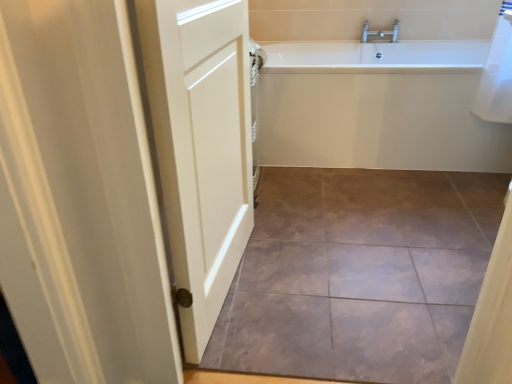
Question: In the image, is white glossy bathtub at upper right on the left side or the right side of white matte door at left?

Choices:
 (A) right
 (B) left

Answer: (A)

Question: Which is correct: white glossy bathtub at upper right is inside white matte door at left, or outside of it?

Choices:
 (A) outside
 (B) inside

Answer: (A)

Question: Considering the real-world distances, which object is farthest from the white glossy bathtub at upper right?

Choices:
 (A) white matte door at left
 (B) brown textured tile at center

Answer: (A)

Question: Based on their relative distances, which object is nearer to the brown textured tile at center?

Choices:
 (A) white glossy bathtub at upper right
 (B) white matte door at left

Answer: (B)